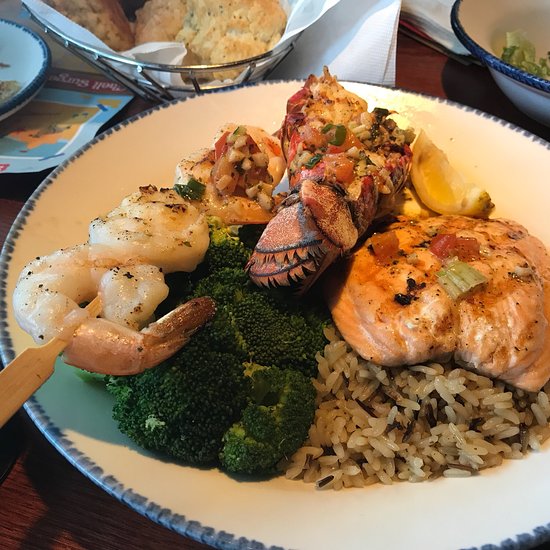
The image size is (550, 550). Find the location of `plate`. plate is located at coordinates (296, 493).